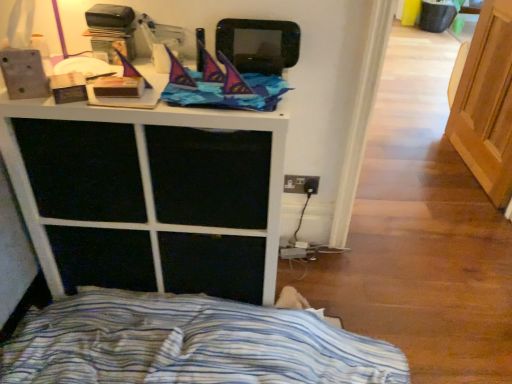
Question: Would you say white matte cabinet at upper center is to the left or to the right of blue striped fabric at lower left in the picture?

Choices:
 (A) left
 (B) right

Answer: (A)

Question: Is point (104, 198) positioned closer to the camera than point (98, 355)?

Choices:
 (A) closer
 (B) farther

Answer: (A)

Question: Based on their relative distances, which object is nearer to the light brown wood screen door at right?

Choices:
 (A) white matte cabinet at upper center
 (B) blue striped fabric at lower left

Answer: (B)

Question: Which object is the closest to the light brown wood screen door at right?

Choices:
 (A) blue striped fabric at lower left
 (B) white matte cabinet at upper center

Answer: (A)